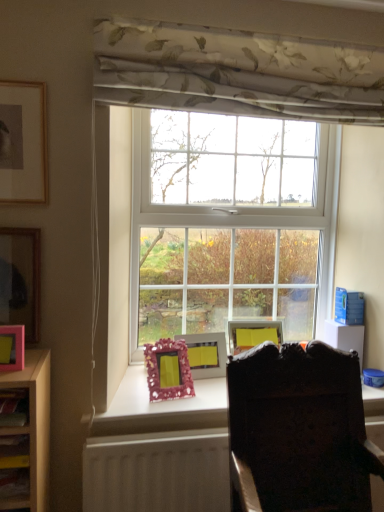
This screenshot has width=384, height=512. I want to click on free location in front of pink glittery picture frame at center, the 1th picture frame in the bottom-to-top sequence, so click(x=169, y=402).